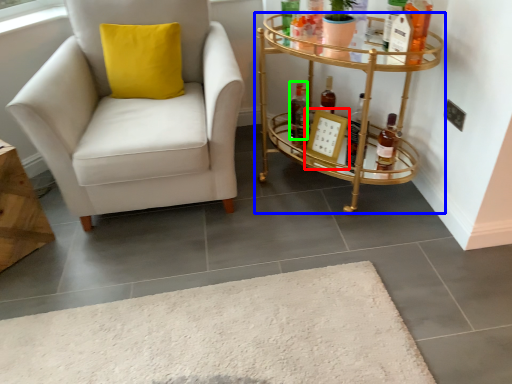
Question: Which object is positioned farthest from picture frame (highlighted by a red box)? Select from table (highlighted by a blue box) and bottle (highlighted by a green box).

Choices:
 (A) table
 (B) bottle

Answer: (A)